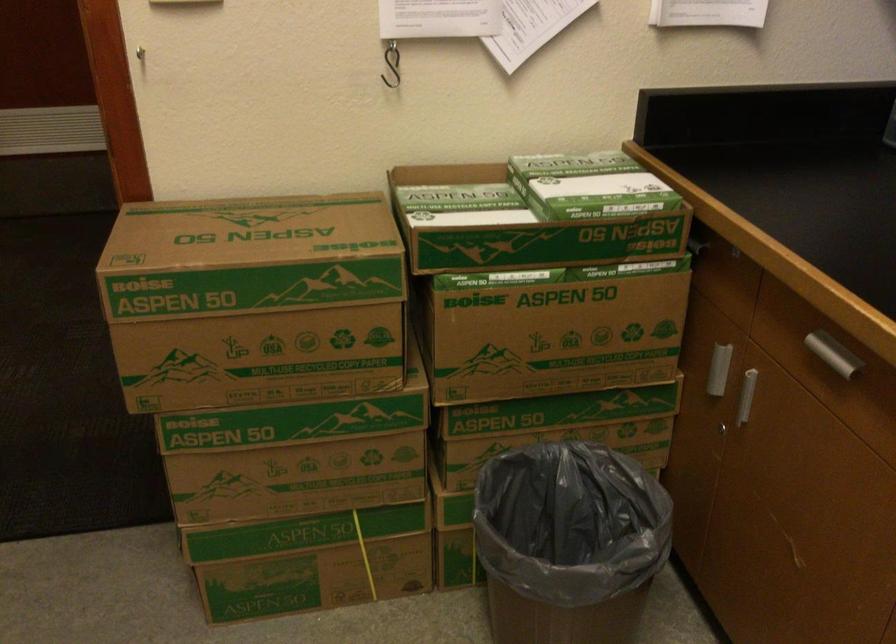
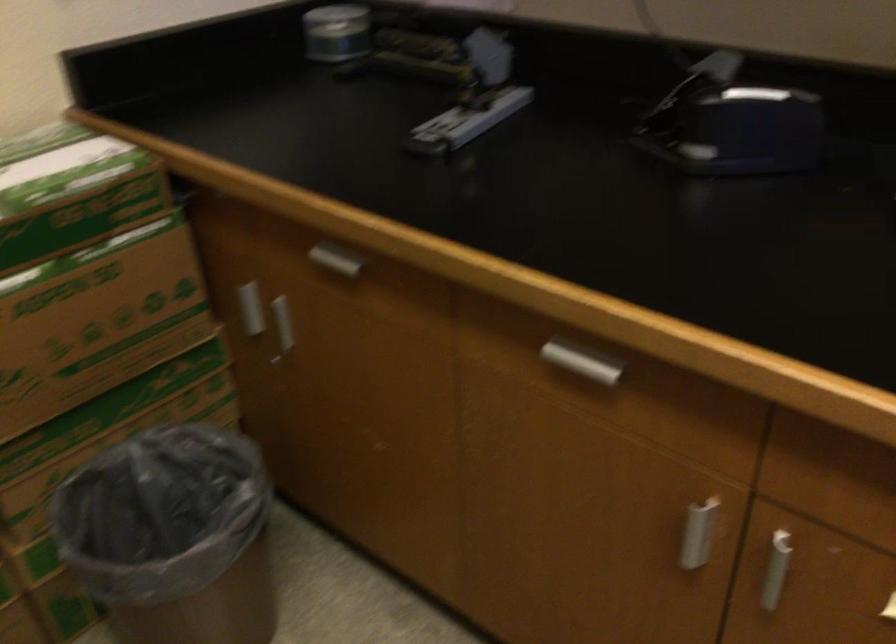
Where in the second image is the point corresponding to pixel 554 522 from the first image?

(159, 512)